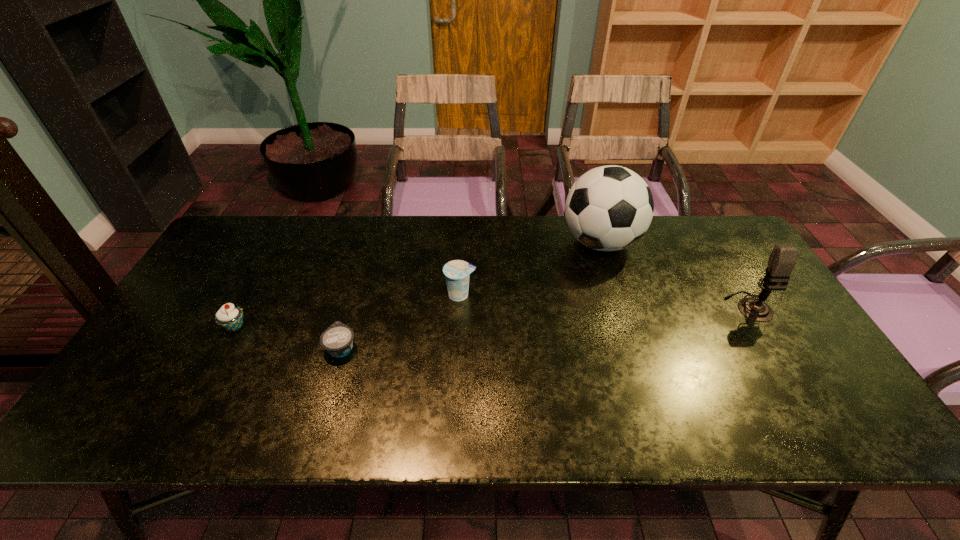
Locate an element on the screen. free space between the left yogurt and the second object from right to left is located at coordinates (471, 295).

The width and height of the screenshot is (960, 540). Find the location of `empty space between the fourth object from left to right and the microphone`. empty space between the fourth object from left to right and the microphone is located at coordinates pos(675,274).

What are the coordinates of `object that is the nearest to the tallest object` in the screenshot? It's located at (782, 260).

At what (x,y) coordinates should I click in order to perform the action: click on object that is the nearest to the microphone. Please return your answer as a coordinate pair (x, y). Image resolution: width=960 pixels, height=540 pixels. Looking at the image, I should click on (608, 208).

The image size is (960, 540). I want to click on free point that satisfies the following two spatial constraints: 1. on the back side of the tallest object; 2. on the right side of the farther yogurt, so click(463, 242).